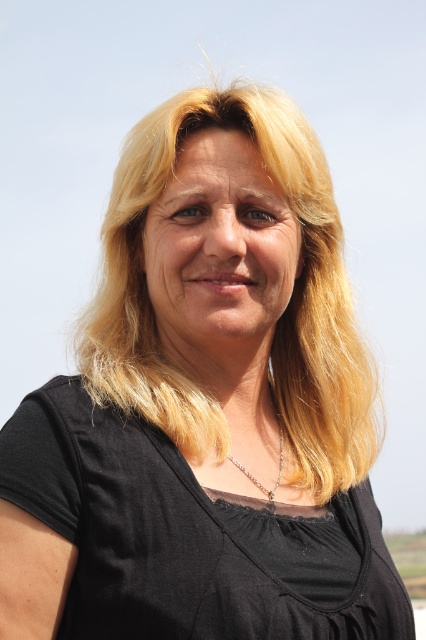
You are a fashion designer trying to decide whether to place a silver metallic necklace at center on a black matte dress at center for a photoshoot. Based on the image, will the necklace be visible against the dress?

The silver metallic necklace at center might be visible against the black matte dress at center since the necklace is metallic and the dress is matte, creating a contrast in texture and possibly in color.

You are a fashion designer who wants to place a golden accessory on the black matte dress at center. According to the coordinates provided, where should you place the accessory to ensure it aligns with the dress?

The black matte dress at center is located at point (180, 536), so the golden accessory should be placed at those coordinates to align with it.

You are a fashion stylist preparing to take a photo of a model wearing the black matte dress at center and the silver metallic necklace at center. Based on the scene description, where should you position the necklace relative to the dress to match the original image?

The silver metallic necklace at center should be positioned to the right of the black matte dress at center, as the black matte dress at center is to the left of the silver metallic necklace at center in the original image.